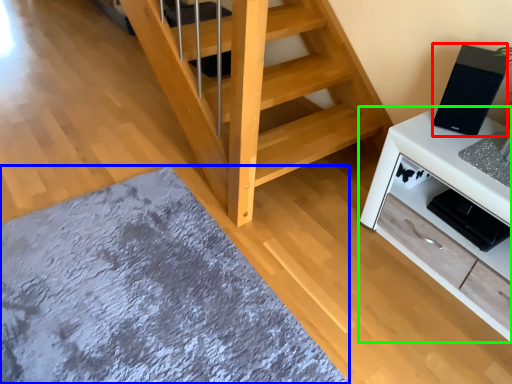
Question: Which object is positioned closest to appliance (highlighted by a red box)? Select from mat (highlighted by a blue box) and cabinetry (highlighted by a green box).

Choices:
 (A) mat
 (B) cabinetry

Answer: (B)